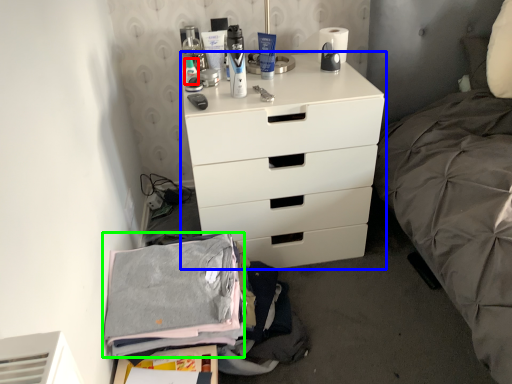
Question: Estimate the real-world distances between objects in this image. Which object is farther from toiletry (highlighted by a red box), chest of drawers (highlighted by a blue box) or clothing (highlighted by a green box)?

Choices:
 (A) chest of drawers
 (B) clothing

Answer: (B)